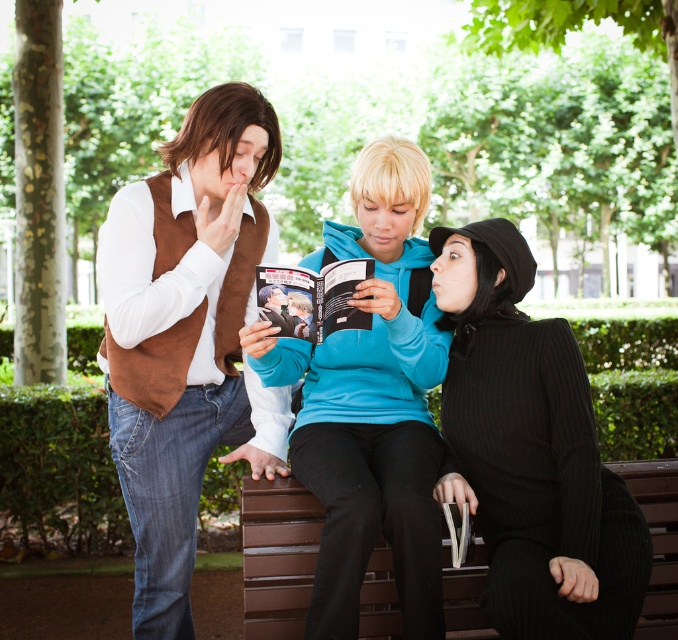
Question: From the image, what is the correct spatial relationship of blue fleece jacket at center in relation to matte brown vest at center?

Choices:
 (A) above
 (B) below

Answer: (B)

Question: From the image, what is the correct spatial relationship of ribbed black sweater at lower right in relation to brown wooden bench at lower center?

Choices:
 (A) below
 (B) above

Answer: (B)

Question: Which of the following is the farthest from the observer?

Choices:
 (A) tap(405, 499)
 (B) tap(479, 449)
 (C) tap(658, 532)
 (D) tap(285, 289)

Answer: (C)

Question: Which point is closer to the camera?

Choices:
 (A) matte brown vest at center
 (B) ribbed black sweater at lower right
 (C) blue fleece jacket at center
 (D) brown wooden bench at lower center

Answer: (B)

Question: Among these points, which one is farthest from the camera?

Choices:
 (A) (523, 333)
 (B) (673, 484)

Answer: (B)

Question: Is ribbed black sweater at lower right smaller than matte brown vest at center?

Choices:
 (A) no
 (B) yes

Answer: (A)